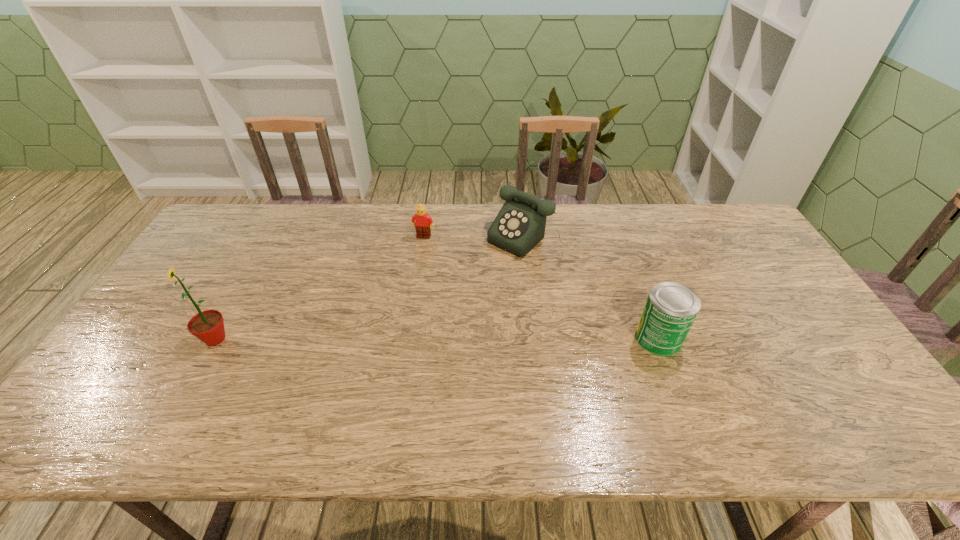
Image resolution: width=960 pixels, height=540 pixels. I want to click on free point at the right edge, so click(x=733, y=272).

You are a GUI agent. You are given a task and a screenshot of the screen. Output one action in this format:
    pyautogui.click(x=<x>, y=<y>)
    Task: Click on the empty location between the telephone and the Lego
    The height and width of the screenshot is (540, 960).
    Given the screenshot: What is the action you would take?
    pyautogui.click(x=478, y=237)

Where is `free space between the can and the leftmost object`? free space between the can and the leftmost object is located at coordinates (437, 339).

You are a GUI agent. You are given a task and a screenshot of the screen. Output one action in this format:
    pyautogui.click(x=<x>, y=<y>)
    Task: Click on the empty space between the Lego and the second object from right to left
    
    Given the screenshot: What is the action you would take?
    pyautogui.click(x=478, y=237)

Where is `free space between the can and the telephone`? free space between the can and the telephone is located at coordinates click(595, 288).

Locate an element on the screen. The image size is (960, 540). free space between the can and the third object from right to left is located at coordinates 541,287.

You are a GUI agent. You are given a task and a screenshot of the screen. Output one action in this format:
    pyautogui.click(x=<x>, y=<y>)
    Task: Click on the free space between the rightmost object and the leftmost object
    
    Given the screenshot: What is the action you would take?
    pyautogui.click(x=437, y=339)

You are a GUI agent. You are given a task and a screenshot of the screen. Output one action in this format:
    pyautogui.click(x=<x>, y=<y>)
    Task: Click on the empty space that is in between the rightmost object and the shortest object
    This screenshot has width=960, height=540.
    Given the screenshot: What is the action you would take?
    541,287

Find the location of `free space between the rightmost object and the shortest object`. free space between the rightmost object and the shortest object is located at coordinates (541, 287).

Locate an element on the screen. The image size is (960, 540). vacant region between the leftmost object and the third object from right to left is located at coordinates (320, 288).